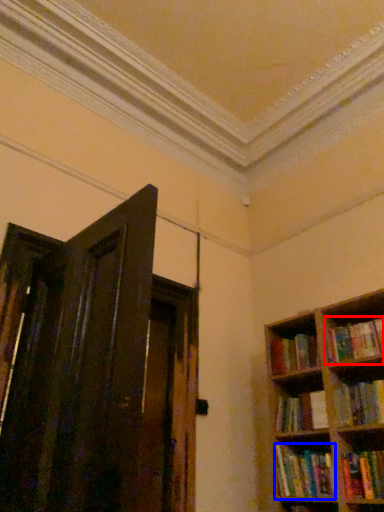
Question: Among these objects, which one is farthest to the camera, book (highlighted by a red box) or book (highlighted by a blue box)?

Choices:
 (A) book
 (B) book

Answer: (A)